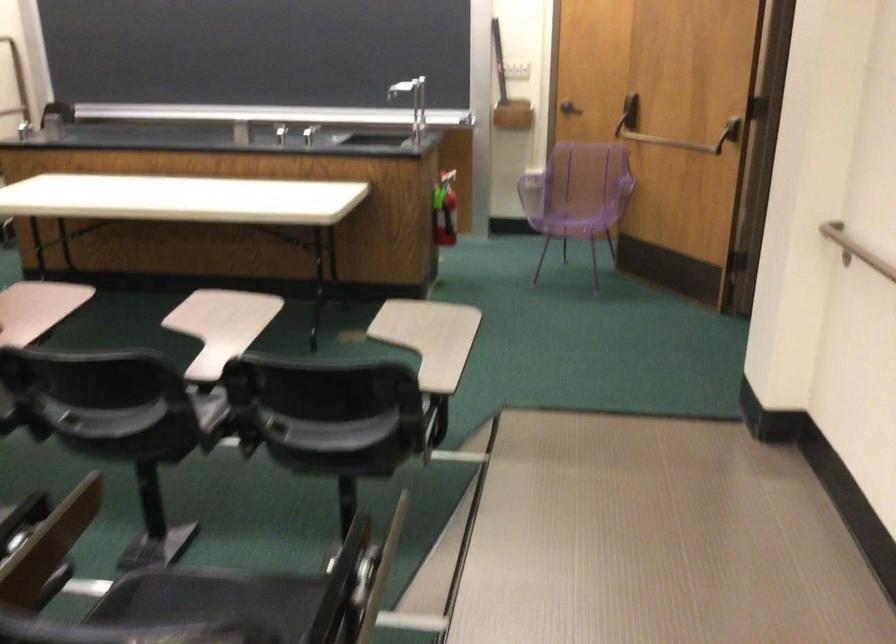
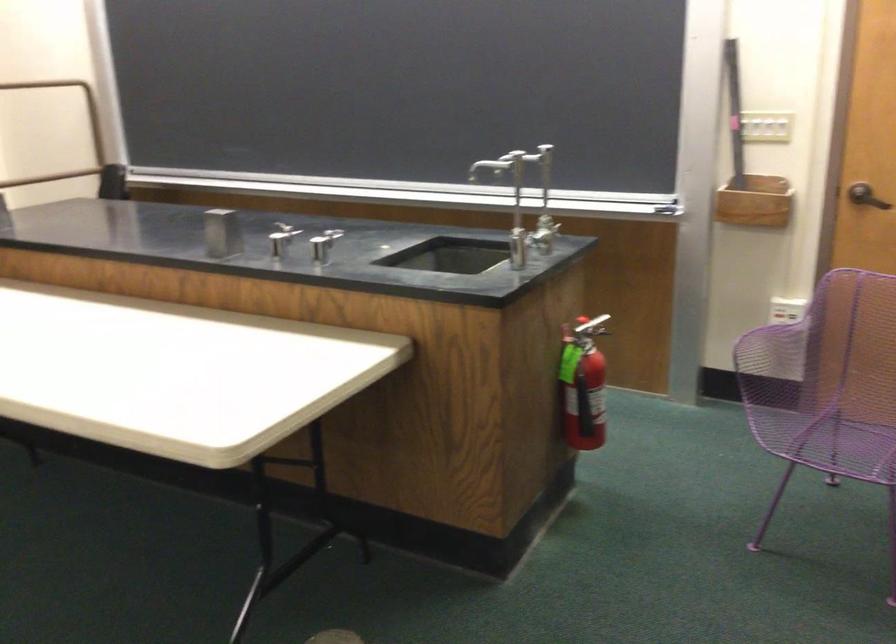
In the second image, find the point that corresponds to [538,167] in the first image.

(787, 310)